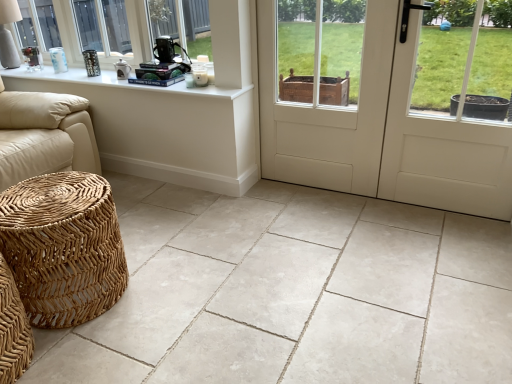
Image resolution: width=512 pixels, height=384 pixels. What are the coordinates of `free space in front of white matte door at center` in the screenshot? It's located at (394, 263).